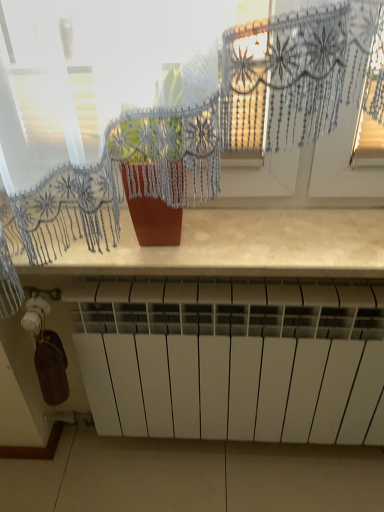
Question: Does transparent lace curtain at upper center have a lesser width compared to matte brown countertop at center?

Choices:
 (A) yes
 (B) no

Answer: (A)

Question: Does transparent lace curtain at upper center have a larger size compared to matte brown countertop at center?

Choices:
 (A) no
 (B) yes

Answer: (B)

Question: Does transparent lace curtain at upper center have a greater height compared to matte brown countertop at center?

Choices:
 (A) no
 (B) yes

Answer: (B)

Question: From the image's perspective, is transparent lace curtain at upper center beneath matte brown countertop at center?

Choices:
 (A) no
 (B) yes

Answer: (A)

Question: Does transparent lace curtain at upper center come behind matte brown countertop at center?

Choices:
 (A) yes
 (B) no

Answer: (B)

Question: Considering the positions of matte brown countertop at center and white matte radiator at lower center in the image, is matte brown countertop at center wider or thinner than white matte radiator at lower center?

Choices:
 (A) thin
 (B) wide

Answer: (B)

Question: From a real-world perspective, is matte brown countertop at center positioned above or below white matte radiator at lower center?

Choices:
 (A) above
 (B) below

Answer: (A)

Question: Is point (379, 271) positioned closer to the camera than point (352, 320)?

Choices:
 (A) closer
 (B) farther

Answer: (A)

Question: Would you say matte brown countertop at center is inside or outside white matte radiator at lower center?

Choices:
 (A) inside
 (B) outside

Answer: (B)

Question: Is transparent lace curtain at upper center taller or shorter than white matte radiator at lower center?

Choices:
 (A) short
 (B) tall

Answer: (A)

Question: Is point (226, 180) positioned closer to the camera than point (302, 410)?

Choices:
 (A) farther
 (B) closer

Answer: (B)

Question: Is transparent lace curtain at upper center bigger or smaller than white matte radiator at lower center?

Choices:
 (A) big
 (B) small

Answer: (B)

Question: Is transparent lace curtain at upper center in front of or behind white matte radiator at lower center in the image?

Choices:
 (A) behind
 (B) front

Answer: (B)

Question: In terms of height, does transparent lace curtain at upper center look taller or shorter compared to matte brown countertop at center?

Choices:
 (A) tall
 (B) short

Answer: (A)

Question: Is transparent lace curtain at upper center wider or thinner than matte brown countertop at center?

Choices:
 (A) wide
 (B) thin

Answer: (B)